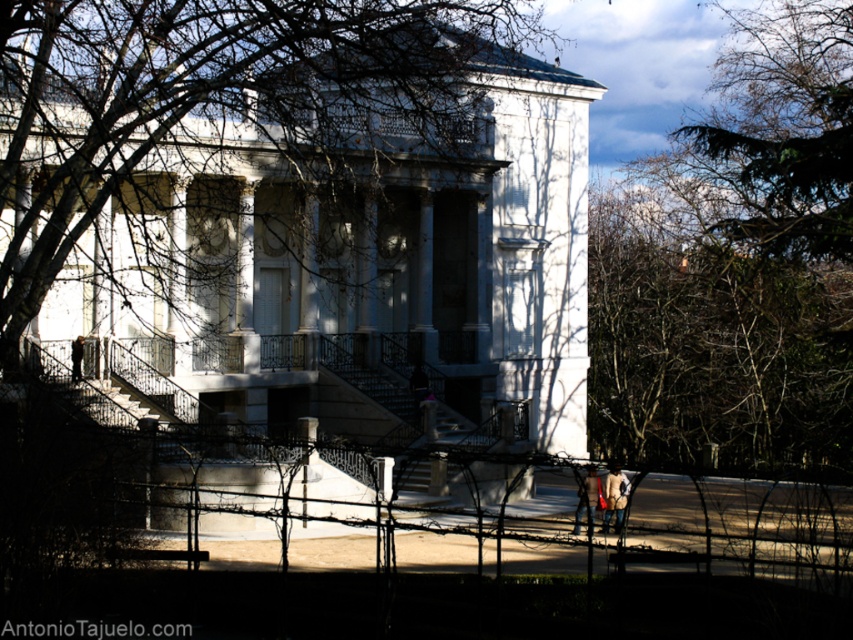
Question: Which object appears farthest from the camera in this image?

Choices:
 (A) leather jacket at lower right
 (B) dark brown leather jacket at lower left
 (C) black wrought iron fence at lower center
 (D) light brown leather jacket at center

Answer: (B)

Question: Which of the following is the closest to the observer?

Choices:
 (A) leather jacket at lower right
 (B) black wrought iron fence at lower center
 (C) light brown leather jacket at center

Answer: (B)

Question: Does black wrought iron fence at lower center appear under dark brown leather jacket at lower left?

Choices:
 (A) no
 (B) yes

Answer: (B)

Question: Is bare branches at center to the right of black wrought iron fence at lower center from the viewer's perspective?

Choices:
 (A) no
 (B) yes

Answer: (A)

Question: Which point is closer to the camera?

Choices:
 (A) bare branches at center
 (B) dark brown leather jacket at lower left
 (C) light brown leather jacket at center

Answer: (A)

Question: Can you confirm if black wrought iron fence at lower center is positioned to the left of leather jacket at lower right?

Choices:
 (A) no
 (B) yes

Answer: (B)